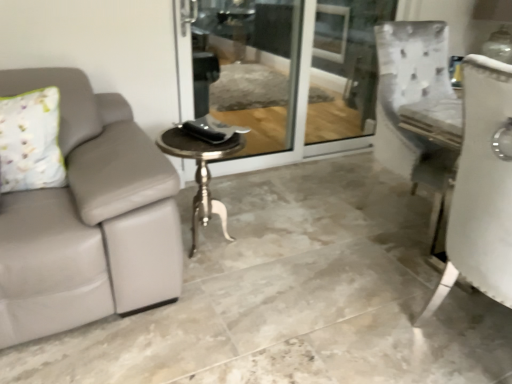
Locate an element on the screen. The image size is (512, 384). vacant space situated above polished silver table at center (from a real-world perspective) is located at coordinates point(209,132).